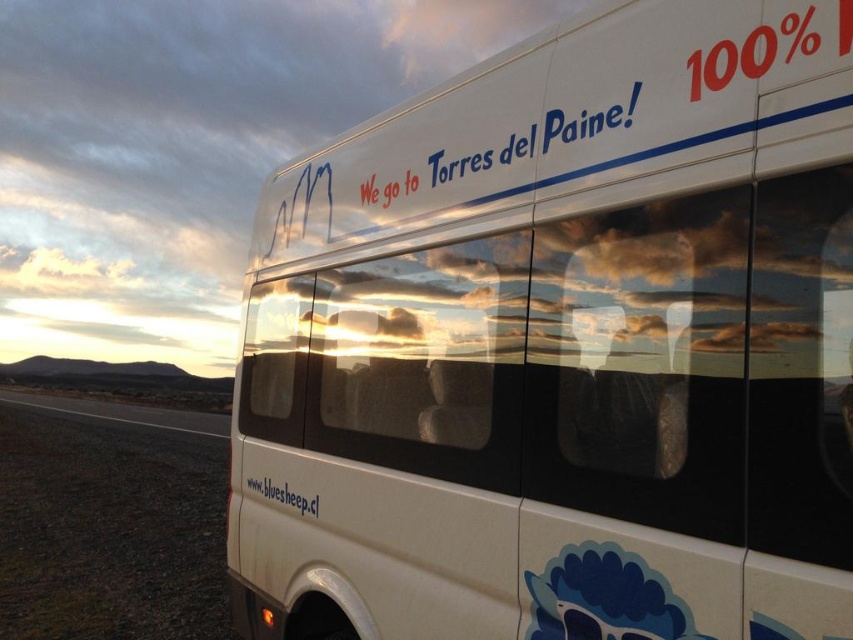
You are standing in front of the white bus and notice two points marked on its side. The first point is at coordinates point (404, 470) and the second at point (317, 506). Which point is closer to you?

Point (404, 470) is closer to the viewer than point (317, 506).

You are a graphic designer reviewing the bus design. The client wants to ensure that the white matte text at lower center is visible against the white matte bus at center. Based on the image, is the text currently legible? Explain your reasoning.

The white matte bus at center is positioned over white matte text at lower center. Since both are white, the text may not be legible against the bus due to the lack of contrast.